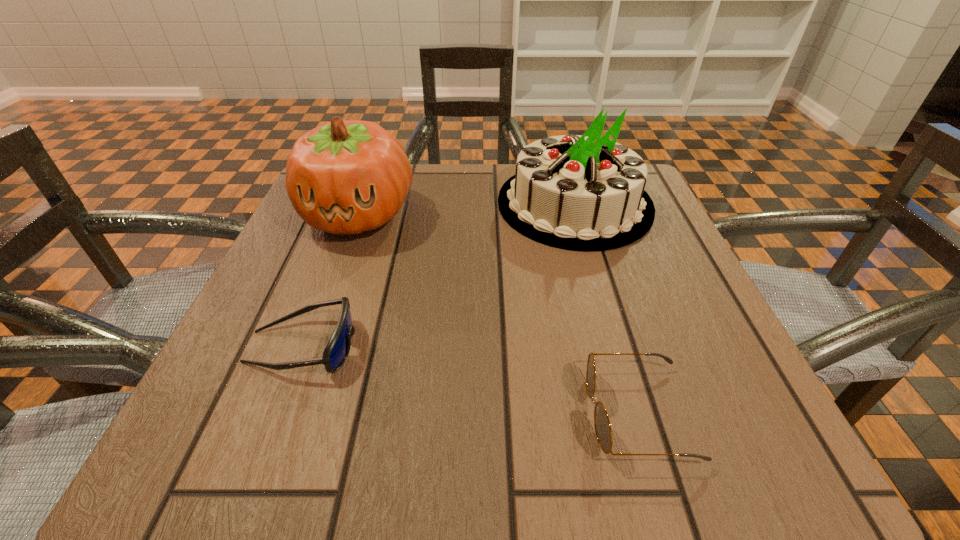
Locate an element on the screen. The image size is (960, 540). vacant area that lies between the birthday cake and the right sunglasses is located at coordinates (606, 308).

The image size is (960, 540). Identify the location of blank region between the birthday cake and the right sunglasses. (606, 308).

At what (x,y) coordinates should I click in order to perform the action: click on vacant area that lies between the pumpkin and the right sunglasses. Please return your answer as a coordinate pair (x, y). The image size is (960, 540). Looking at the image, I should click on (498, 314).

You are a GUI agent. You are given a task and a screenshot of the screen. Output one action in this format:
    pyautogui.click(x=<x>, y=<y>)
    Task: Click on the empty location between the pumpkin and the birthday cake
    This screenshot has width=960, height=540.
    Given the screenshot: What is the action you would take?
    pyautogui.click(x=467, y=209)

The image size is (960, 540). What are the coordinates of `free spot between the left sunglasses and the right sunglasses` in the screenshot? It's located at (470, 380).

Image resolution: width=960 pixels, height=540 pixels. What are the coordinates of `vacant space in between the birthday cake and the right sunglasses` in the screenshot? It's located at (606, 308).

Locate an element on the screen. the second closest object to the birthday cake is located at coordinates (603, 430).

Choose which object is the nearest neighbor to the left sunglasses. Please provide its 2D coordinates. Your answer should be formatted as a tuple, i.e. [(x, y)], where the tuple contains the x and y coordinates of a point satisfying the conditions above.

[(345, 177)]

Where is `vacant space that satisfies the following two spatial constraints: 1. on the side of the pumpkin with the cute face; 2. on the front-facing side of the left sunglasses`? The height and width of the screenshot is (540, 960). vacant space that satisfies the following two spatial constraints: 1. on the side of the pumpkin with the cute face; 2. on the front-facing side of the left sunglasses is located at coordinates (311, 347).

Where is `vacant region that satisfies the following two spatial constraints: 1. on the side of the pumpkin with the cute face; 2. on the front-facing side of the left sunglasses`? vacant region that satisfies the following two spatial constraints: 1. on the side of the pumpkin with the cute face; 2. on the front-facing side of the left sunglasses is located at coordinates (311, 347).